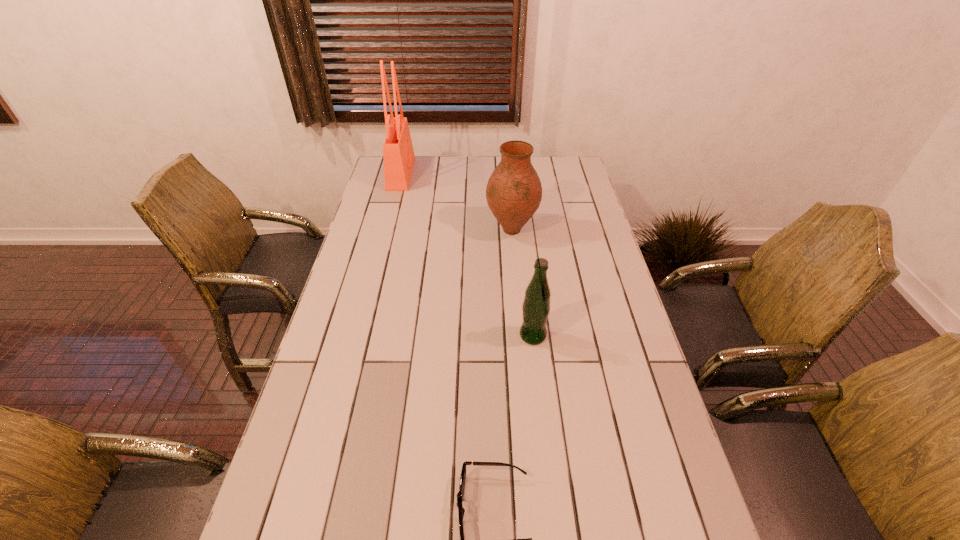
This screenshot has height=540, width=960. Find the location of `the tallest object`. the tallest object is located at coordinates (398, 154).

The image size is (960, 540). Identify the location of tote bag. (398, 154).

Find the location of `vase`. vase is located at coordinates [514, 191].

I want to click on the third farthest object, so tap(536, 306).

Find the location of a particular element. The height and width of the screenshot is (540, 960). the third tallest object is located at coordinates (536, 306).

You are a GUI agent. You are given a task and a screenshot of the screen. Output one action in this format:
    pyautogui.click(x=<x>, y=<y>)
    Task: Click on the vacant area situated 0.150m on the logo side of the leftmost object
    
    Given the screenshot: What is the action you would take?
    pyautogui.click(x=446, y=174)

Find the location of a particular element. Image resolution: width=960 pixels, height=540 pixels. free location located on the back of the second farthest object is located at coordinates (507, 177).

Image resolution: width=960 pixels, height=540 pixels. Identify the location of free space located on the back of the second shortest object. (528, 289).

Where is `object located in the far edge section of the desktop`? object located in the far edge section of the desktop is located at coordinates [x=398, y=154].

The height and width of the screenshot is (540, 960). What are the coordinates of `object that is at the left edge` in the screenshot? It's located at (398, 154).